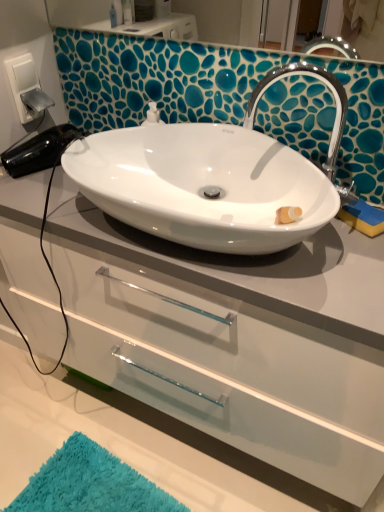
Measure the distance between chrome metallic faucet at upper right and camera.

chrome metallic faucet at upper right and camera are 33.15 inches apart from each other.

What do you see at coordinates (23, 84) in the screenshot?
I see `silver metallic switch at upper left` at bounding box center [23, 84].

The width and height of the screenshot is (384, 512). Describe the element at coordinates (90, 484) in the screenshot. I see `turquoise shaggy bath mat at lower left` at that location.

Locate an element on the screen. turquoise shaggy bath mat at lower left is located at coordinates click(90, 484).

Identify the location of white glossy sink at center. This screenshot has width=384, height=512. (212, 178).

Considering the relative sizes of turquoise shaggy bath mat at lower left and silver metallic switch at upper left in the image provided, is turquoise shaggy bath mat at lower left taller than silver metallic switch at upper left?

No, turquoise shaggy bath mat at lower left is not taller than silver metallic switch at upper left.

Is turquoise shaggy bath mat at lower left situated inside silver metallic switch at upper left or outside?

turquoise shaggy bath mat at lower left is not enclosed by silver metallic switch at upper left.

Considering the sizes of objects turquoise shaggy bath mat at lower left and silver metallic switch at upper left in the image provided, who is bigger, turquoise shaggy bath mat at lower left or silver metallic switch at upper left?

turquoise shaggy bath mat at lower left is bigger.

Is there a large distance between turquoise shaggy bath mat at lower left and silver metallic switch at upper left?

That's right, there is a large distance between turquoise shaggy bath mat at lower left and silver metallic switch at upper left.

Could you tell me if white glossy sink at center is turned towards silver metallic switch at upper left?

No, white glossy sink at center is not aimed at silver metallic switch at upper left.

Is point (254, 203) positioned after point (30, 53)?

No, (254, 203) is closer to viewer.

Considering the relative sizes of white glossy sink at center and silver metallic switch at upper left in the image provided, is white glossy sink at center taller than silver metallic switch at upper left?

No.

From a real-world perspective, is white glossy sink at center below silver metallic switch at upper left?

Correct, in the physical world, white glossy sink at center is lower than silver metallic switch at upper left.

Can you confirm if white glossy sink at center is positioned to the right of white glossy cabinet at center?

Correct, you'll find white glossy sink at center to the right of white glossy cabinet at center.

From a real-world perspective, is white glossy sink at center over white glossy cabinet at center?

Yes, from a real-world perspective, white glossy sink at center is on top of white glossy cabinet at center.

Is point (190, 203) closer or farther from the camera than point (228, 364)?

Point (190, 203) is closer to the camera than point (228, 364).

Considering the relative sizes of white glossy cabinet at center and white glossy sink at center in the image provided, is white glossy cabinet at center thinner than white glossy sink at center?

A: In fact, white glossy cabinet at center might be wider than white glossy sink at center.

Does white glossy cabinet at center appear on the left side of white glossy sink at center?

Indeed, white glossy cabinet at center is positioned on the left side of white glossy sink at center.

Who is bigger, white glossy cabinet at center or white glossy sink at center?

white glossy cabinet at center is bigger.

From the image's perspective, which object appears higher, white glossy cabinet at center or white glossy sink at center?

white glossy sink at center, from the image's perspective.

Is there a large distance between silver metallic switch at upper left and white glossy sink at center?

No, there isn't a large distance between silver metallic switch at upper left and white glossy sink at center.

From a real-world perspective, relative to white glossy sink at center, is silver metallic switch at upper left vertically above or below?

From a real-world perspective, silver metallic switch at upper left is physically above white glossy sink at center.

Could you tell me if silver metallic switch at upper left is turned towards white glossy sink at center?

Yes.

Is white glossy sink at center looking in the opposite direction of chrome metallic faucet at upper right?

No, chrome metallic faucet at upper right is not at the back of white glossy sink at center.

Consider the image. Is white glossy sink at center behind chrome metallic faucet at upper right?

No, it is in front of chrome metallic faucet at upper right.

From the image's perspective, which is below, white glossy sink at center or chrome metallic faucet at upper right?

white glossy sink at center, from the image's perspective.

From the picture: Which object is positioned more to the right, white glossy cabinet at center or chrome metallic faucet at upper right?

Positioned to the right is chrome metallic faucet at upper right.

Is white glossy cabinet at center in front of chrome metallic faucet at upper right?

Yes, white glossy cabinet at center is in front of chrome metallic faucet at upper right.

From the image's perspective, is white glossy cabinet at center on chrome metallic faucet at upper right?

No, from the image's perspective, white glossy cabinet at center is not over chrome metallic faucet at upper right.

From a real-world perspective, is white glossy cabinet at center located beneath chrome metallic faucet at upper right?

Yes, from a real-world perspective, white glossy cabinet at center is beneath chrome metallic faucet at upper right.

Where is `bath mat below the silver metallic switch at upper left (from a real-world perspective)`? This screenshot has width=384, height=512. bath mat below the silver metallic switch at upper left (from a real-world perspective) is located at coordinates (90, 484).

Identify the location of electric outlet that is above the white glossy sink at center (from the image's perspective). Image resolution: width=384 pixels, height=512 pixels. (23, 84).

From the picture: From the image, which object appears to be nearer to silver metallic switch at upper left, white glossy cabinet at center or turquoise shaggy bath mat at lower left?

Among the two, white glossy cabinet at center is located nearer to silver metallic switch at upper left.

Considering their positions, is white glossy sink at center positioned further to silver metallic switch at upper left than chrome metallic faucet at upper right?

Based on the image, chrome metallic faucet at upper right appears to be further to silver metallic switch at upper left.

When comparing their distances from white glossy sink at center, does chrome metallic faucet at upper right or turquoise shaggy bath mat at lower left seem closer?

chrome metallic faucet at upper right is closer to white glossy sink at center.

When comparing their distances from silver metallic switch at upper left, does white glossy sink at center or white glossy cabinet at center seem closer?

Among the two, white glossy sink at center is located nearer to silver metallic switch at upper left.

Looking at the image, which one is located further to silver metallic switch at upper left, chrome metallic faucet at upper right or white glossy cabinet at center?

white glossy cabinet at center is further to silver metallic switch at upper left.

From the image, which object appears to be farther from white glossy cabinet at center, silver metallic switch at upper left or turquoise shaggy bath mat at lower left?

The object further to white glossy cabinet at center is silver metallic switch at upper left.

Based on their spatial positions, is white glossy cabinet at center or white glossy sink at center further from silver metallic switch at upper left?

Based on the image, white glossy cabinet at center appears to be further to silver metallic switch at upper left.

Considering their positions, is chrome metallic faucet at upper right positioned further to turquoise shaggy bath mat at lower left than white glossy cabinet at center?

The object further to turquoise shaggy bath mat at lower left is chrome metallic faucet at upper right.

The image size is (384, 512). Find the location of `sink between chrome metallic faucet at upper right and turquoise shaggy bath mat at lower left vertically`. sink between chrome metallic faucet at upper right and turquoise shaggy bath mat at lower left vertically is located at coordinates (212, 178).

Locate an element on the screen. The width and height of the screenshot is (384, 512). sink between silver metallic switch at upper left and turquoise shaggy bath mat at lower left in the up-down direction is located at coordinates (212, 178).

Where is `sink between white glossy cabinet at center and chrome metallic faucet at upper right in the horizontal direction`? This screenshot has width=384, height=512. sink between white glossy cabinet at center and chrome metallic faucet at upper right in the horizontal direction is located at coordinates (212, 178).

You are a GUI agent. You are given a task and a screenshot of the screen. Output one action in this format:
    pyautogui.click(x=<x>, y=<y>)
    Task: Click on the sink between silver metallic switch at upper left and chrome metallic faucet at upper right from left to right
    The image size is (384, 512).
    Given the screenshot: What is the action you would take?
    pyautogui.click(x=212, y=178)